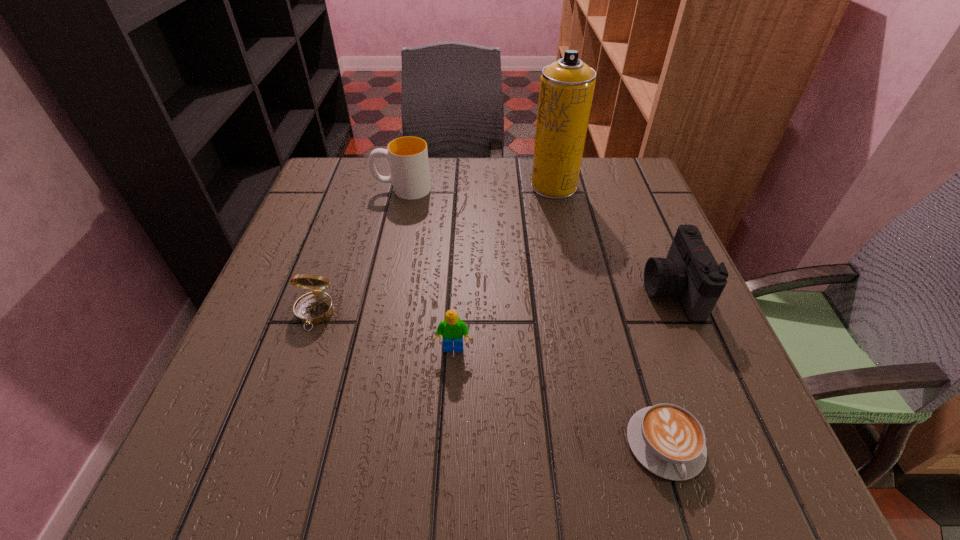
Identify the location of cup that is at the left edge. (408, 156).

This screenshot has width=960, height=540. I want to click on compass present at the left edge, so click(315, 307).

You are a GUI agent. You are given a task and a screenshot of the screen. Output one action in this format:
    pyautogui.click(x=<x>, y=<y>)
    Task: Click on the camera present at the right edge
    Image resolution: width=960 pixels, height=540 pixels.
    Given the screenshot: What is the action you would take?
    pyautogui.click(x=690, y=272)

Locate an element on the screen. The image size is (960, 540). cappuccino present at the right edge is located at coordinates (666, 439).

Identify the location of object located in the far left corner section of the desktop. (408, 156).

The image size is (960, 540). Identify the location of object that is at the near right corner. (666, 439).

In the image, there is a desktop. In order to click on vacant space at the far edge in this screenshot , I will do `click(507, 157)`.

Where is `free space at the left edge`? This screenshot has width=960, height=540. free space at the left edge is located at coordinates (341, 221).

The height and width of the screenshot is (540, 960). In the image, there is a desktop. What are the coordinates of `free space at the right edge` in the screenshot? It's located at [702, 381].

In the image, there is a desktop. Where is `vacant space at the far left corner`? Image resolution: width=960 pixels, height=540 pixels. vacant space at the far left corner is located at coordinates (368, 193).